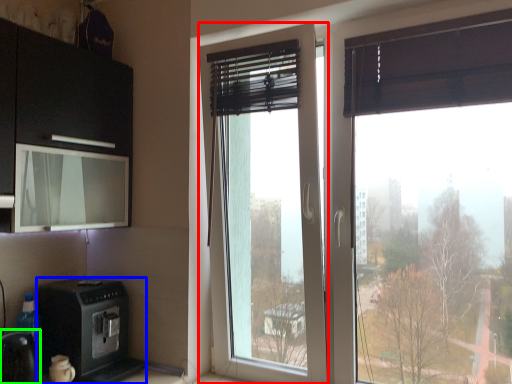
Question: Which object is the farthest from window (highlighted by a red box)? Choose among these: home appliance (highlighted by a blue box) or appliance (highlighted by a green box).

Choices:
 (A) home appliance
 (B) appliance

Answer: (B)